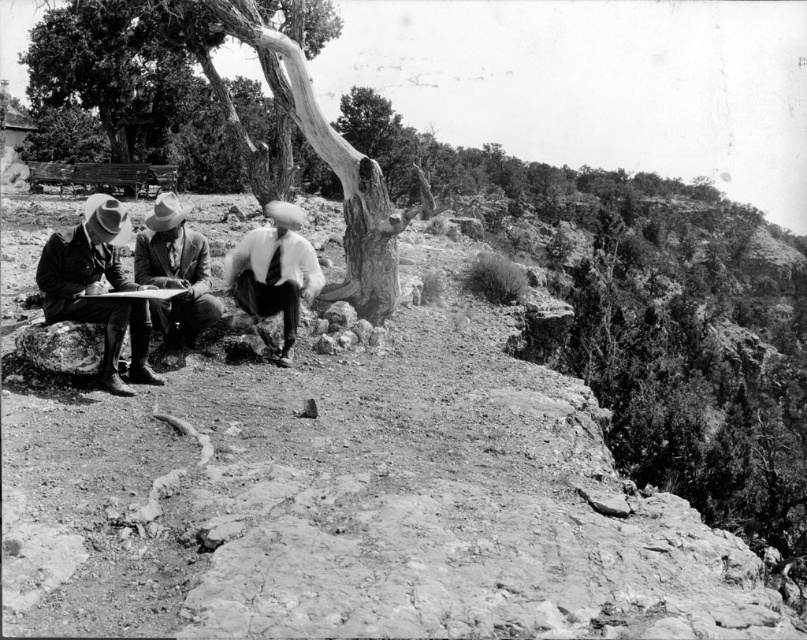
Question: Which of the following is the farthest from the observer?

Choices:
 (A) smooth bark tree at center
 (B) smooth brown suit at center

Answer: (A)

Question: In this image, where is rugged stone hillside at center located relative to smooth brown suit at center?

Choices:
 (A) right
 (B) left

Answer: (A)

Question: Can you confirm if rugged stone hillside at center is positioned to the right of smooth bark tree at center?

Choices:
 (A) yes
 (B) no

Answer: (A)

Question: From the image, what is the correct spatial relationship of smooth bark tree at center in relation to smooth brown suit at center?

Choices:
 (A) below
 (B) above

Answer: (B)

Question: Among these objects, which one is farthest from the camera?

Choices:
 (A) smooth brown suit at center
 (B) matte black suit at left
 (C) white cotton shirt at center

Answer: (C)

Question: Which object appears farthest from the camera in this image?

Choices:
 (A) smooth brown suit at center
 (B) matte black suit at left

Answer: (A)